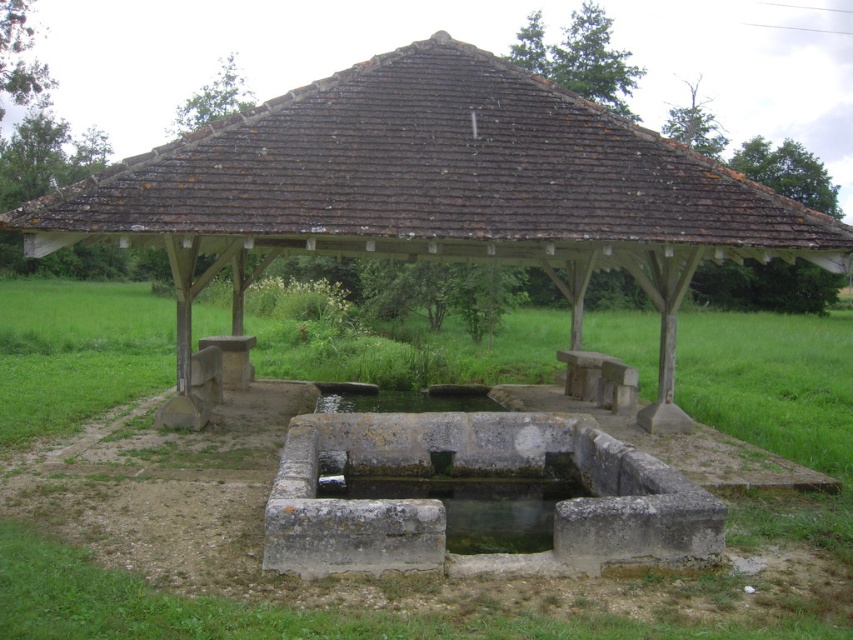
You are standing in the grassy field near the historical well or fountain. You notice a point at coordinates (434, 193). What object is located at that point?

The stone roofed hut at center is located at point (434, 193).

You are standing in the grassy field and want to take a photo of the stone roofed hut at center. Since the green grass at center is in the way, can you kneel down to avoid it?

The stone roofed hut at center is located above green grass at center, so if you kneel down, you can position yourself lower to avoid the grass and capture the hut in your photo.